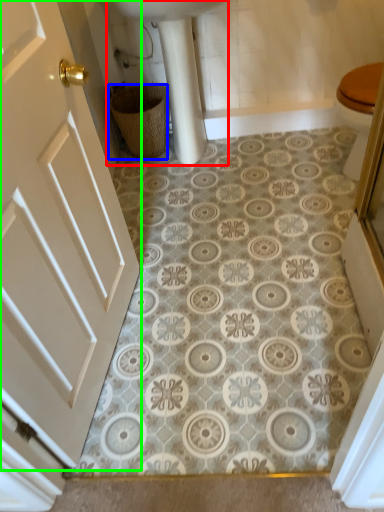
Question: Which object is the farthest from sink (highlighted by a red box)? Choose among these: basket (highlighted by a blue box) or door (highlighted by a green box).

Choices:
 (A) basket
 (B) door

Answer: (B)